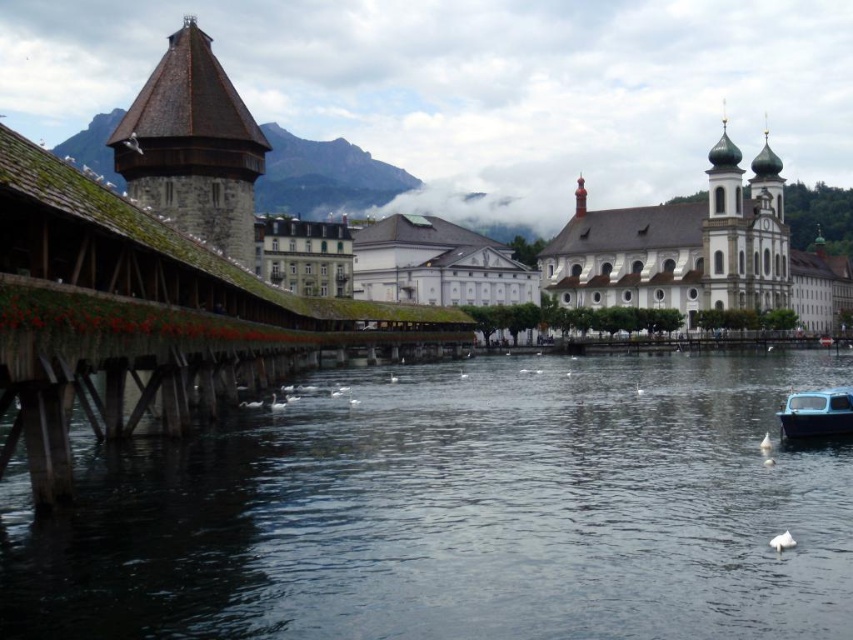
Question: Based on their relative distances, which object is nearer to the brown stone tower at upper left?

Choices:
 (A) white stone church at upper right
 (B) dark blue water at center

Answer: (B)

Question: Does brown stone tower at upper left have a smaller size compared to white stone church at upper right?

Choices:
 (A) no
 (B) yes

Answer: (B)

Question: In this image, where is white stone church at upper right located relative to blue matte boat at lower right?

Choices:
 (A) left
 (B) right

Answer: (B)

Question: Among these objects, which one is nearest to the camera?

Choices:
 (A) blue matte boat at lower right
 (B) dark blue water at center
 (C) white stone church at upper right
 (D) brown stone tower at upper left

Answer: (B)

Question: Which object is positioned closest to the brown stone tower at upper left?

Choices:
 (A) white stone church at upper right
 (B) blue matte boat at lower right
 (C) dark blue water at center

Answer: (C)

Question: Is brown stone tower at upper left above white stone church at upper right?

Choices:
 (A) yes
 (B) no

Answer: (A)